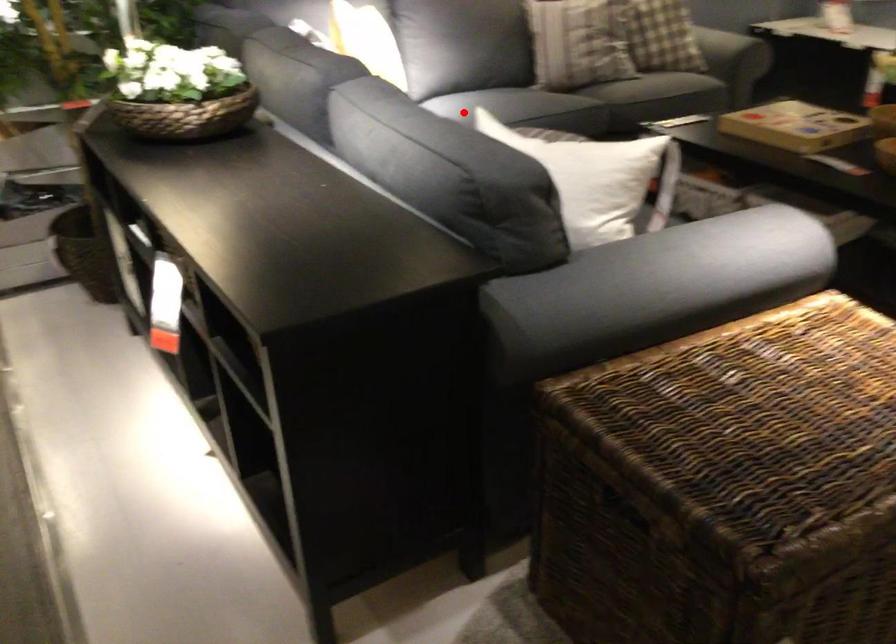
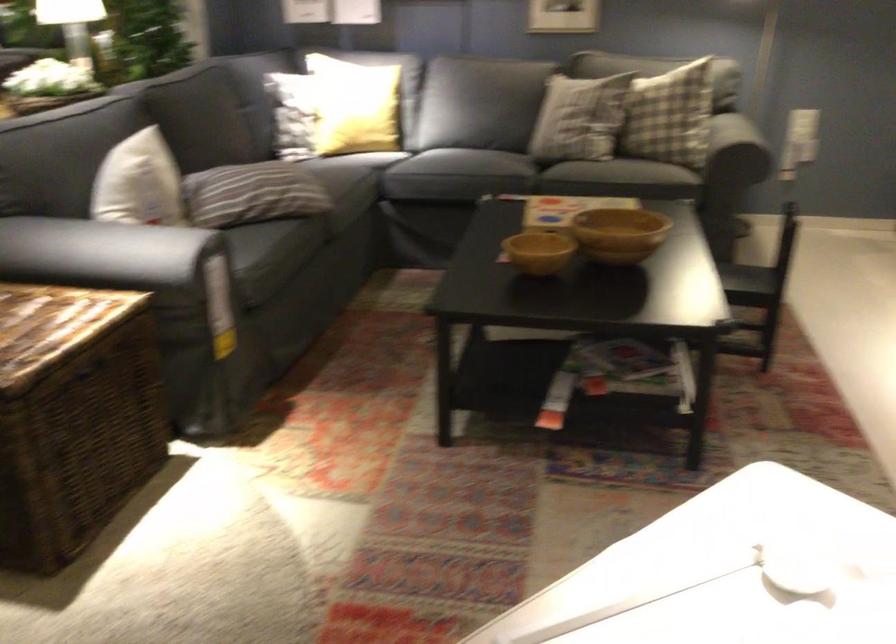
Question: I am providing you with two images of the same scene from different viewpoints. A red point is shown in image1. For the corresponding object point in image2, is it positioned nearer or farther from the camera?

Choices:
 (A) Nearer
 (B) Farther

Answer: (B)